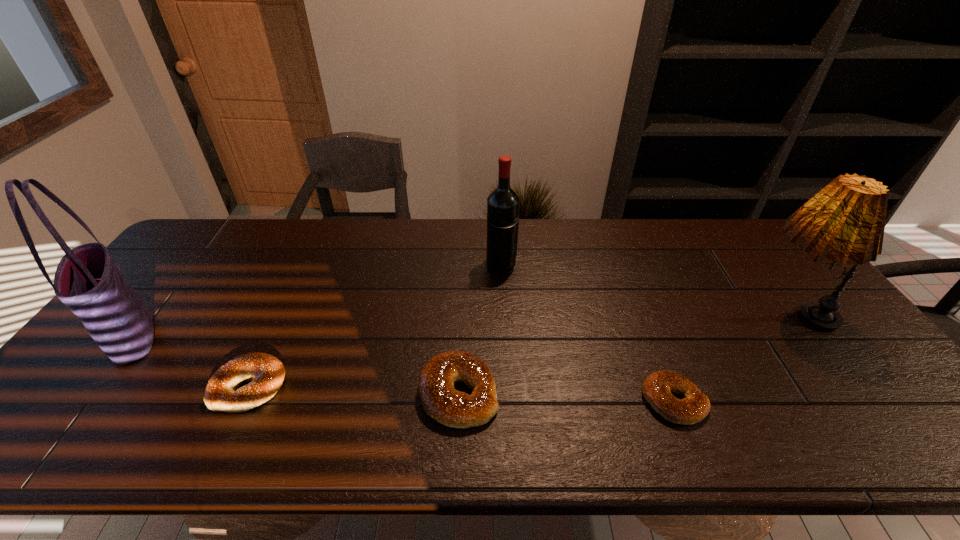
Please point a free position for a bagel on the right. Please provide its 2D coordinates. Your answer should be formatted as a tuple, i.e. [(x, y)], where the tuple contains the x and y coordinates of a point satisfying the conditions above.

[(897, 408)]